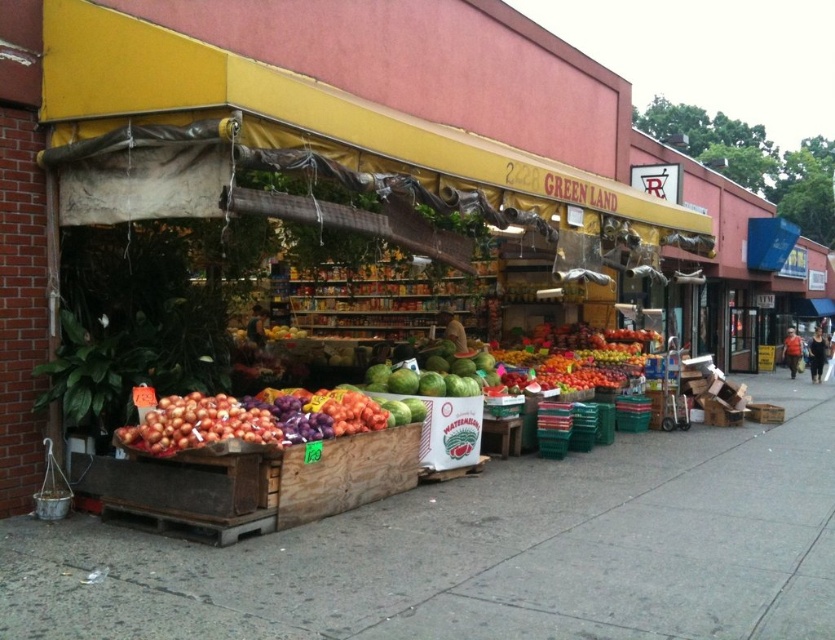
You are a customer at the GREEN LAND market stall. You want to find the wooden crates at center. According to the stall layout, where would you look?

The wooden crates at center are located at point 0.864 on the x axis and 0.583 on the y axis.